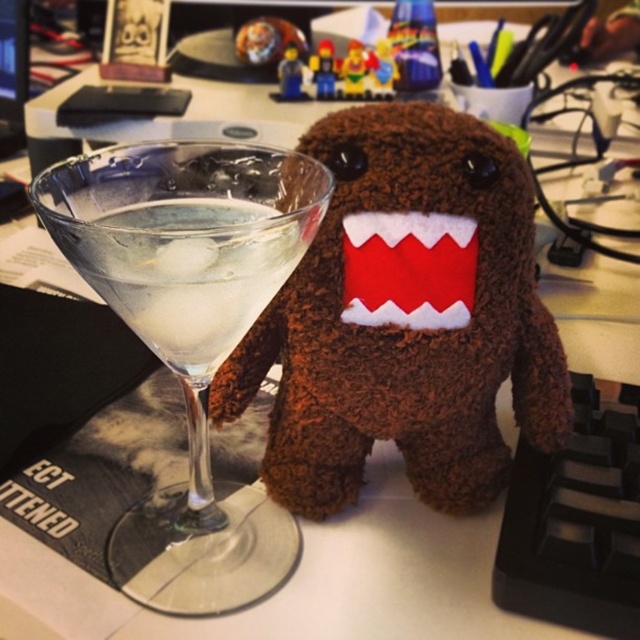
You are organizing items on a desk and need to place a new object between the transparent glass martini at left and the Domo plush toy. Where should you position the new object to ensure it is equidistant from both items?

The new object should be placed exactly halfway between the transparent glass martini at left and the Domo plush toy to ensure it is equidistant from both.

You are organizing a desk and need to place both the transparent glass martini at left and the smooth plastic minifigure at center into a storage container. The container has a height limit of 10 cm. Which item might not fit if placed upright?

The transparent glass martini at left is taller than the smooth plastic minifigure at center, so the transparent glass martini at left might not fit in the container if placed upright.